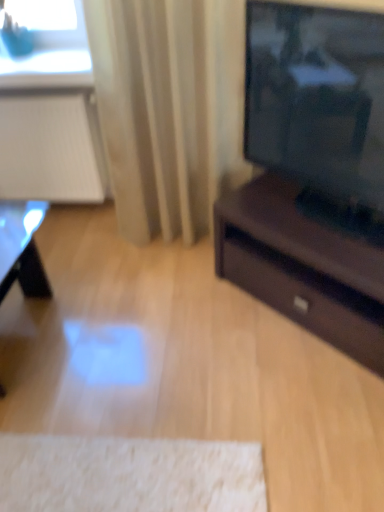
Question: From a real-world perspective, is blue matte glass at upper left over shiny black table at lower left?

Choices:
 (A) yes
 (B) no

Answer: (A)

Question: From the image's perspective, is blue matte glass at upper left on shiny black table at lower left?

Choices:
 (A) yes
 (B) no

Answer: (A)

Question: Can you confirm if blue matte glass at upper left is taller than shiny black table at lower left?

Choices:
 (A) yes
 (B) no

Answer: (B)

Question: Does blue matte glass at upper left have a smaller size compared to shiny black table at lower left?

Choices:
 (A) no
 (B) yes

Answer: (B)

Question: Is blue matte glass at upper left to the right of shiny black table at lower left from the viewer's perspective?

Choices:
 (A) no
 (B) yes

Answer: (A)

Question: Can you confirm if blue matte glass at upper left is shorter than shiny black table at lower left?

Choices:
 (A) yes
 (B) no

Answer: (A)

Question: Is beige fabric curtain at center at the back of blue matte glass at upper left?

Choices:
 (A) no
 (B) yes

Answer: (A)

Question: Considering the relative sizes of blue matte glass at upper left and beige fabric curtain at center in the image provided, is blue matte glass at upper left smaller than beige fabric curtain at center?

Choices:
 (A) yes
 (B) no

Answer: (A)

Question: Is the surface of blue matte glass at upper left in direct contact with beige fabric curtain at center?

Choices:
 (A) no
 (B) yes

Answer: (A)

Question: Does blue matte glass at upper left have a greater width compared to beige fabric curtain at center?

Choices:
 (A) yes
 (B) no

Answer: (B)

Question: From the image's perspective, is blue matte glass at upper left located above beige fabric curtain at center?

Choices:
 (A) yes
 (B) no

Answer: (A)

Question: Can we say blue matte glass at upper left lies outside beige fabric curtain at center?

Choices:
 (A) no
 (B) yes

Answer: (B)

Question: From the image's perspective, is shiny black table at lower left under beige fabric curtain at center?

Choices:
 (A) yes
 (B) no

Answer: (A)